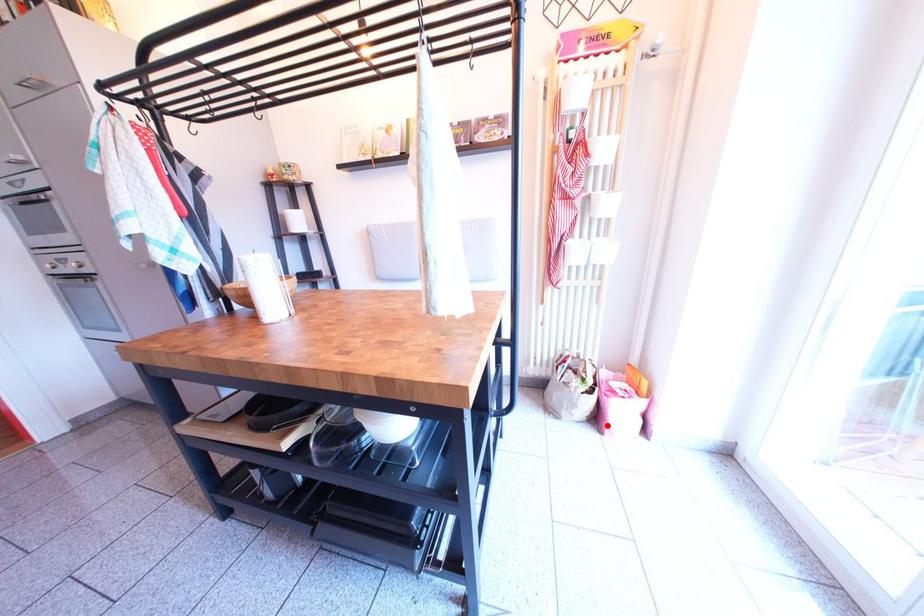
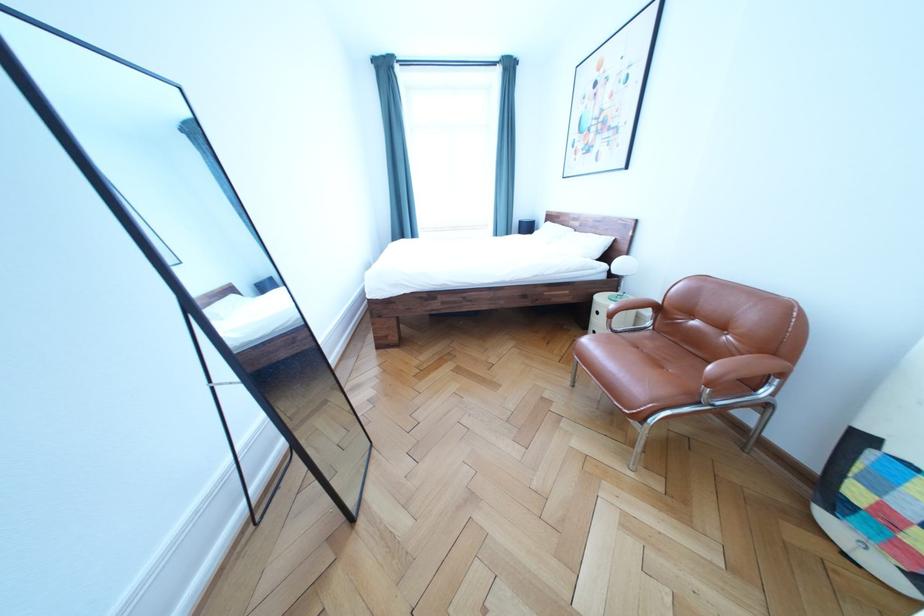
Question: I am providing you with two images of the same scene from different viewpoints. A red point is marked on the first image. At the location where the point appears in image 1, is it still visible in image 2?

Choices:
 (A) Yes
 (B) No

Answer: (B)